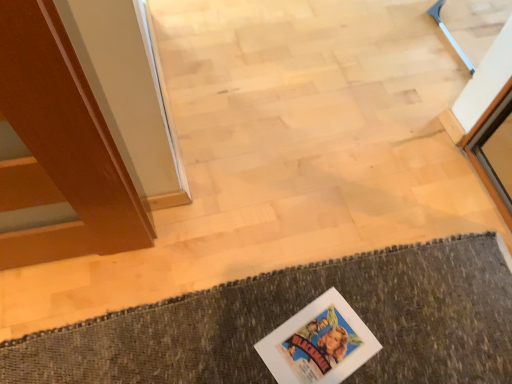
What do you see at coordinates (293, 314) in the screenshot? I see `textured wool bath mat at lower center` at bounding box center [293, 314].

Find the location of a particular element. textured wool bath mat at lower center is located at coordinates (293, 314).

Locate an element on the screen. colorful paper comic book at lower center is located at coordinates (318, 343).

This screenshot has height=384, width=512. What do you see at coordinates (318, 343) in the screenshot? I see `colorful paper comic book at lower center` at bounding box center [318, 343].

Identify the location of textured wool bath mat at lower center. (293, 314).

Is textured wool bath mat at lower center to the left or to the right of colorful paper comic book at lower center in the image?

Clearly, textured wool bath mat at lower center is on the left of colorful paper comic book at lower center in the image.

Considering the relative positions of textured wool bath mat at lower center and colorful paper comic book at lower center in the image provided, is textured wool bath mat at lower center behind colorful paper comic book at lower center?

No, textured wool bath mat at lower center is in front of colorful paper comic book at lower center.

Between point (268, 320) and point (352, 334), which one is positioned behind?

The point (268, 320) is more distant.

From the picture: From the image's perspective, is textured wool bath mat at lower center positioned above or below colorful paper comic book at lower center?

textured wool bath mat at lower center is situated lower than colorful paper comic book at lower center in the image.

Based on the photo, from a real-world perspective, who is located lower, textured wool bath mat at lower center or colorful paper comic book at lower center?

In real-world perspective, textured wool bath mat at lower center is lower.

Which object is thinner, textured wool bath mat at lower center or colorful paper comic book at lower center?

Thinner between the two is colorful paper comic book at lower center.

Is textured wool bath mat at lower center taller than colorful paper comic book at lower center?

Yes, textured wool bath mat at lower center is taller than colorful paper comic book at lower center.

Considering the sizes of objects textured wool bath mat at lower center and colorful paper comic book at lower center in the image provided, who is bigger, textured wool bath mat at lower center or colorful paper comic book at lower center?

With larger size is textured wool bath mat at lower center.

Is textured wool bath mat at lower center surrounding colorful paper comic book at lower center?

Yes, textured wool bath mat at lower center contains colorful paper comic book at lower center.

Is textured wool bath mat at lower center positioned far away from colorful paper comic book at lower center?

No, textured wool bath mat at lower center is in close proximity to colorful paper comic book at lower center.

Does textured wool bath mat at lower center turn towards colorful paper comic book at lower center?

Yes.

Can you tell me how much textured wool bath mat at lower center and colorful paper comic book at lower center differ in facing direction?

The angular difference between textured wool bath mat at lower center and colorful paper comic book at lower center is 112 degrees.

Identify the location of bath mat on the left side of colorful paper comic book at lower center. (293, 314).

Does colorful paper comic book at lower center appear on the left side of textured wool bath mat at lower center?

No.

From the picture: Is colorful paper comic book at lower center closer to camera compared to textured wool bath mat at lower center?

No, it is behind textured wool bath mat at lower center.

Between point (325, 300) and point (359, 312), which one is positioned in front?

Positioned in front is point (359, 312).

From the image's perspective, between colorful paper comic book at lower center and textured wool bath mat at lower center, which one is located above?

From the image's view, colorful paper comic book at lower center is above.

From a real-world perspective, does colorful paper comic book at lower center sit lower than textured wool bath mat at lower center?

No, from a real-world perspective, colorful paper comic book at lower center is not beneath textured wool bath mat at lower center.

Considering the sizes of objects colorful paper comic book at lower center and textured wool bath mat at lower center in the image provided, who is thinner, colorful paper comic book at lower center or textured wool bath mat at lower center?

colorful paper comic book at lower center.

From their relative heights in the image, would you say colorful paper comic book at lower center is taller or shorter than textured wool bath mat at lower center?

In the image, colorful paper comic book at lower center appears to be shorter than textured wool bath mat at lower center.

Who is smaller, colorful paper comic book at lower center or textured wool bath mat at lower center?

Smaller between the two is colorful paper comic book at lower center.

Is colorful paper comic book at lower center spatially inside textured wool bath mat at lower center, or outside of it?

colorful paper comic book at lower center is spatially positioned inside textured wool bath mat at lower center.

Does colorful paper comic book at lower center touch textured wool bath mat at lower center?

colorful paper comic book at lower center and textured wool bath mat at lower center are clearly separated.

Is textured wool bath mat at lower center at the back of colorful paper comic book at lower center?

Correct, colorful paper comic book at lower center is looking away from textured wool bath mat at lower center.

How many degrees apart are the facing directions of colorful paper comic book at lower center and textured wool bath mat at lower center?

There is a 112-degree angle between the facing directions of colorful paper comic book at lower center and textured wool bath mat at lower center.

How distant is colorful paper comic book at lower center from textured wool bath mat at lower center?

They are 5.67 inches apart.

I want to click on bath mat that appears on the left of colorful paper comic book at lower center, so click(x=293, y=314).

This screenshot has width=512, height=384. In order to click on bath mat below the colorful paper comic book at lower center (from a real-world perspective) in this screenshot , I will do point(293,314).

The height and width of the screenshot is (384, 512). What are the coordinates of `comic book located on the right of textured wool bath mat at lower center` in the screenshot? It's located at (318, 343).